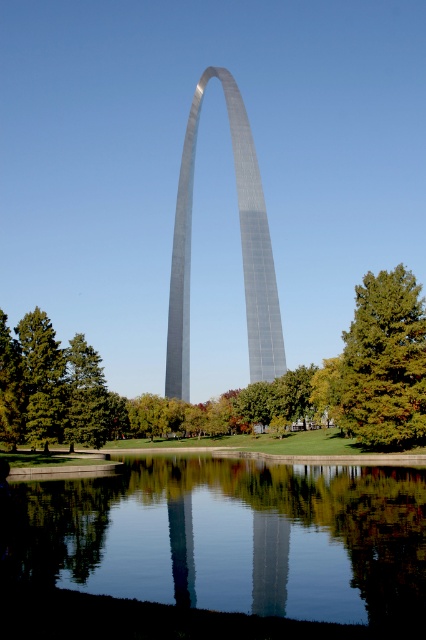
Question: Is transparent glass water at center above shiny metallic arch at center?

Choices:
 (A) no
 (B) yes

Answer: (A)

Question: Considering the relative positions of green matte tree at lower right and green matte tree at lower left in the image provided, where is green matte tree at lower right located with respect to green matte tree at lower left?

Choices:
 (A) above
 (B) below

Answer: (A)

Question: Which object is the closest to the transparent glass water at center?

Choices:
 (A) shiny metallic arch at center
 (B) green matte tree at lower left
 (C) green matte tree at lower right

Answer: (C)

Question: Which of these objects is positioned farthest from the green matte tree at lower left?

Choices:
 (A) transparent glass water at center
 (B) shiny metallic arch at center

Answer: (B)

Question: Which object is closer to the camera taking this photo?

Choices:
 (A) green matte tree at lower right
 (B) green matte tree at lower left

Answer: (A)

Question: Does shiny metallic arch at center appear on the left side of green matte tree at lower left?

Choices:
 (A) no
 (B) yes

Answer: (A)